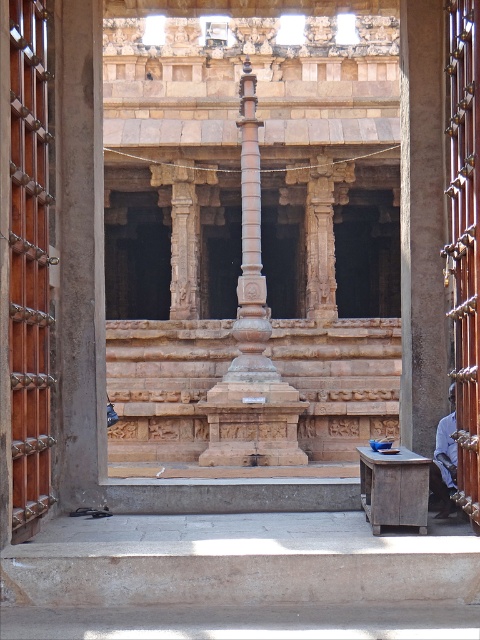
Question: Can you confirm if polished stone pillar at center is positioned to the left of blue fabric shirt at right?

Choices:
 (A) yes
 (B) no

Answer: (A)

Question: Which object appears farthest from the camera in this image?

Choices:
 (A) polished stone pillar at center
 (B) blue fabric shirt at right

Answer: (A)

Question: Can you confirm if polished stone pillar at center is smaller than blue fabric shirt at right?

Choices:
 (A) no
 (B) yes

Answer: (A)

Question: Is polished stone pillar at center above blue fabric shirt at right?

Choices:
 (A) yes
 (B) no

Answer: (A)

Question: Which point is farther to the camera?

Choices:
 (A) polished stone pillar at center
 (B) blue fabric shirt at right

Answer: (A)